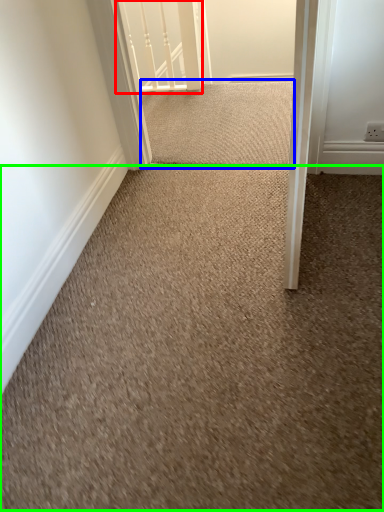
Question: Which object is the farthest from rail (highlighted by a red box)? Choose among these: doormat (highlighted by a blue box) or granite (highlighted by a green box).

Choices:
 (A) doormat
 (B) granite

Answer: (B)